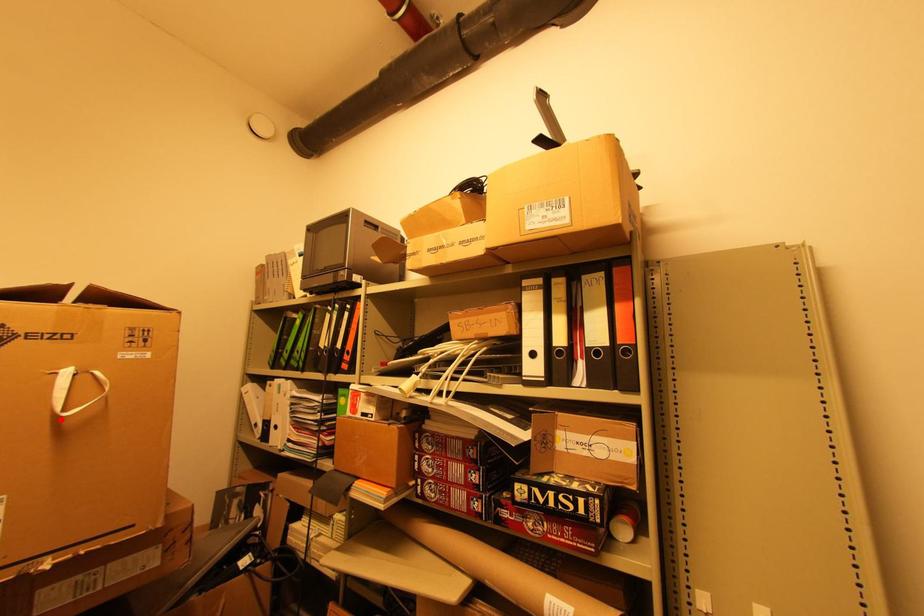
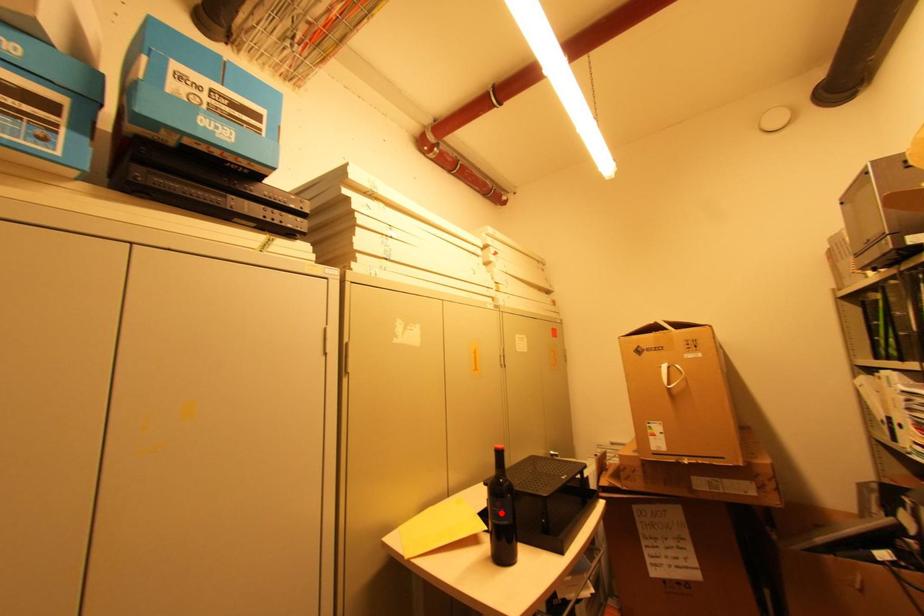
I am providing you with two images of the same scene from different viewpoints. A red point is marked on the first image and another point is marked on the second image. Is the red point in image1 aligned with the point shown in image2?

No